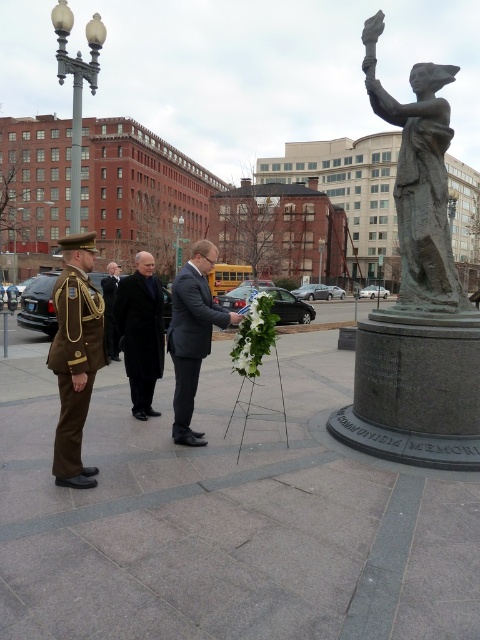
Can you confirm if dark gray wool coat at center is shorter than dark brown uniform at left?

In fact, dark gray wool coat at center may be taller than dark brown uniform at left.

Who is more forward, (140, 332) or (112, 332)?

Point (140, 332)

Locate an element on the screen. Image resolution: width=480 pixels, height=640 pixels. dark gray wool coat at center is located at coordinates (141, 332).

The width and height of the screenshot is (480, 640). What do you see at coordinates (192, 333) in the screenshot? I see `matte black suit at center` at bounding box center [192, 333].

Does matte black suit at center appear under dark brown uniform at left?

No.

Find the location of a particular element. matte black suit at center is located at coordinates (192, 333).

Which is more to the left, bronze statue at right or dark gray wool coat at center?

Positioned to the left is dark gray wool coat at center.

Who is more forward, (450, 285) or (141, 298)?

Point (450, 285) is in front.

The image size is (480, 640). Find the location of `bronze statue at right`. bronze statue at right is located at coordinates (420, 180).